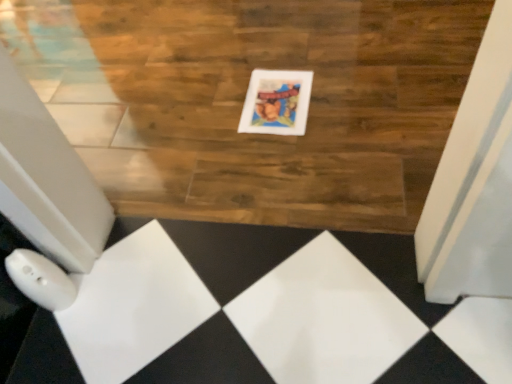
Question: Should I look upward or downward to see white glossy picture frame at center?

Choices:
 (A) up
 (B) down

Answer: (A)

Question: Considering the relative sizes of white glossy picture frame at center and wooden floor at center in the image provided, is white glossy picture frame at center wider than wooden floor at center?

Choices:
 (A) yes
 (B) no

Answer: (B)

Question: Is white glossy picture frame at center facing away from wooden floor at center?

Choices:
 (A) no
 (B) yes

Answer: (B)

Question: Does white glossy picture frame at center have a smaller size compared to wooden floor at center?

Choices:
 (A) no
 (B) yes

Answer: (B)

Question: Considering the relative positions of white glossy picture frame at center and wooden floor at center in the image provided, is white glossy picture frame at center to the left of wooden floor at center from the viewer's perspective?

Choices:
 (A) yes
 (B) no

Answer: (B)

Question: Is white glossy picture frame at center oriented towards wooden floor at center?

Choices:
 (A) no
 (B) yes

Answer: (B)

Question: Is white glossy picture frame at center positioned beyond the bounds of wooden floor at center?

Choices:
 (A) no
 (B) yes

Answer: (A)

Question: Does wooden floor at center appear on the left side of white glossy picture frame at center?

Choices:
 (A) no
 (B) yes

Answer: (B)

Question: Is white glossy picture frame at center surrounded by wooden floor at center?

Choices:
 (A) yes
 (B) no

Answer: (A)

Question: Does wooden floor at center have a smaller size compared to white glossy picture frame at center?

Choices:
 (A) yes
 (B) no

Answer: (B)

Question: From a real-world perspective, is wooden floor at center positioned over white glossy picture frame at center based on gravity?

Choices:
 (A) yes
 (B) no

Answer: (B)

Question: Is wooden floor at center behind white glossy picture frame at center?

Choices:
 (A) no
 (B) yes

Answer: (A)

Question: From the image's perspective, does wooden floor at center appear higher than white glossy picture frame at center?

Choices:
 (A) no
 (B) yes

Answer: (B)

Question: Considering the positions of wooden floor at center and white glossy picture frame at center in the image, is wooden floor at center taller or shorter than white glossy picture frame at center?

Choices:
 (A) tall
 (B) short

Answer: (A)